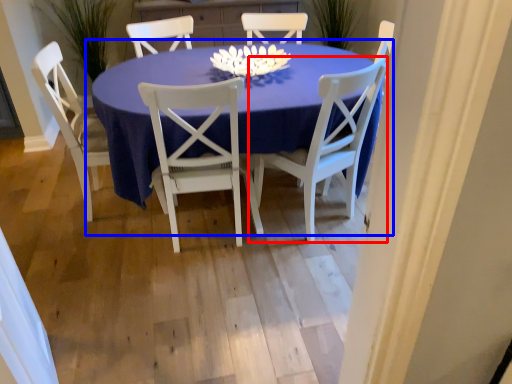
Question: Which point is further to the camera, chair (highlighted by a red box) or kitchen & dining room table (highlighted by a blue box)?

Choices:
 (A) chair
 (B) kitchen & dining room table

Answer: (A)